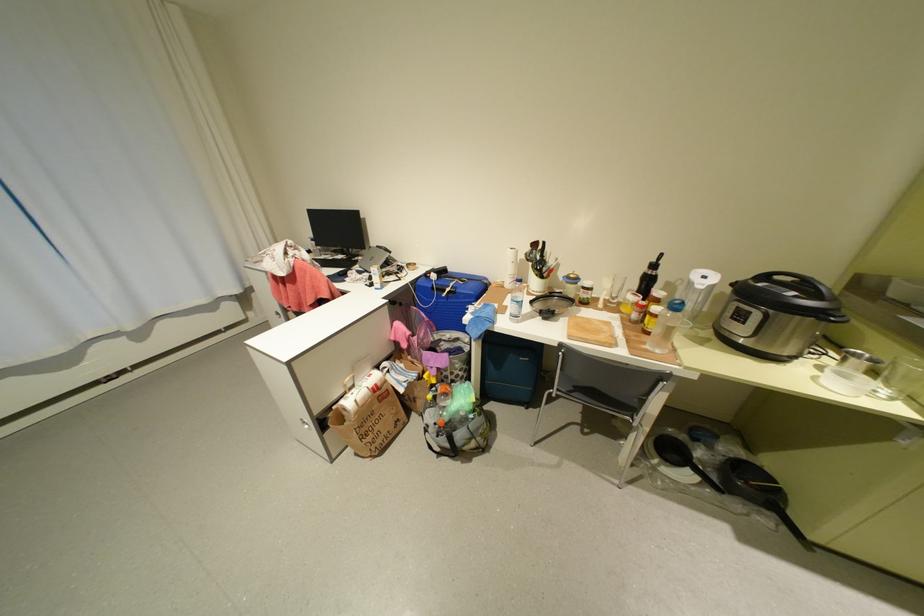
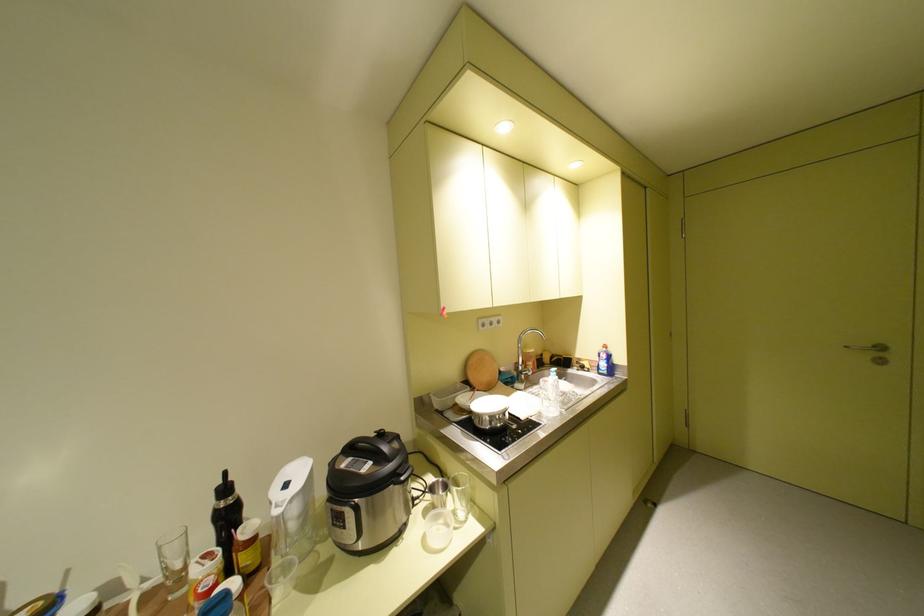
Question: The camera is either moving clockwise (left) or counter-clockwise (right) around the object. The first image is from the beginning of the video and the second image is from the end. Is the camera moving left or right when shooting the video?

Choices:
 (A) Left
 (B) Right

Answer: (A)